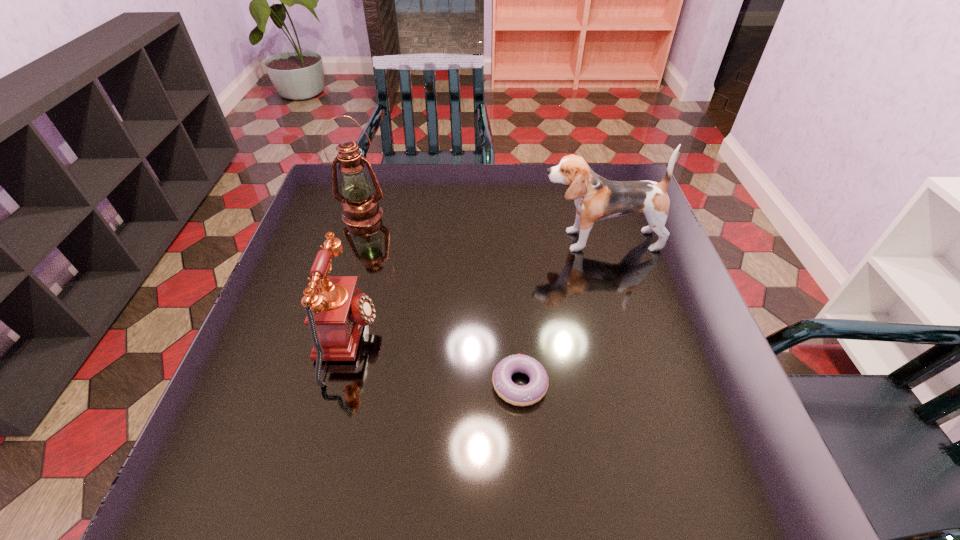
Point out which object is positioned as the nearest to the telephone. Please provide its 2D coordinates. Your answer should be formatted as a tuple, i.e. [(x, y)], where the tuple contains the x and y coordinates of a point satisfying the conditions above.

[(534, 391)]

I want to click on free region that satisfies the following two spatial constraints: 1. on the dial of the second shortest object; 2. on the left side of the doughnut, so click(337, 384).

At what (x,y) coordinates should I click in order to perform the action: click on blank space that satisfies the following two spatial constraints: 1. on the dial of the second shortest object; 2. on the right side of the doughnut. Please return your answer as a coordinate pair (x, y). The height and width of the screenshot is (540, 960). Looking at the image, I should click on (337, 384).

Find the location of a particular element. This screenshot has height=540, width=960. free space that satisfies the following two spatial constraints: 1. on the front side of the farthest object; 2. on the right side of the doughnut is located at coordinates (309, 384).

Identify the location of free space that satisfies the following two spatial constraints: 1. at the face of the third nearest object; 2. on the front side of the second object from right to left. Image resolution: width=960 pixels, height=540 pixels. (641, 384).